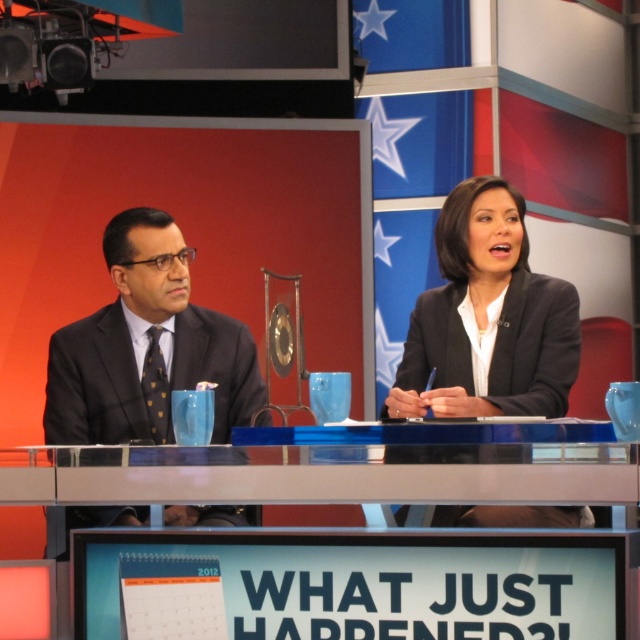
Question: Can you confirm if blue plastic table at center is positioned to the left of matte black suit at left?

Choices:
 (A) no
 (B) yes

Answer: (A)

Question: Is blue plastic table at center to the right of matte black suit at left from the viewer's perspective?

Choices:
 (A) yes
 (B) no

Answer: (A)

Question: Estimate the real-world distances between objects in this image. Which object is closer to the blue plastic table at center?

Choices:
 (A) matte black suit at left
 (B) black glossy blazer at center

Answer: (B)

Question: Is black glossy blazer at center positioned before matte black suit at left?

Choices:
 (A) yes
 (B) no

Answer: (A)

Question: Which point is closer to the camera taking this photo?

Choices:
 (A) (147, 259)
 (B) (51, 493)

Answer: (B)

Question: Which object appears closest to the camera in this image?

Choices:
 (A) matte black suit at left
 (B) black glossy blazer at center
 (C) blue plastic table at center

Answer: (C)